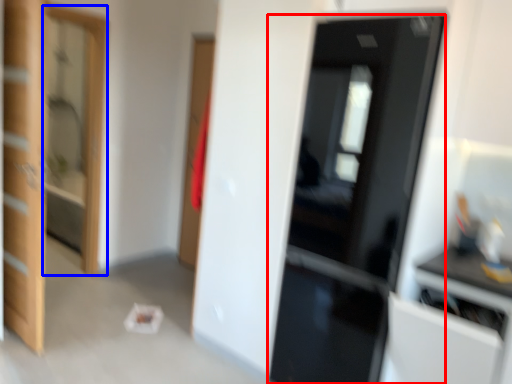
Question: Which of the following is the farthest to the observer, door (highlighted by a red box) or screen door (highlighted by a blue box)?

Choices:
 (A) door
 (B) screen door

Answer: (B)